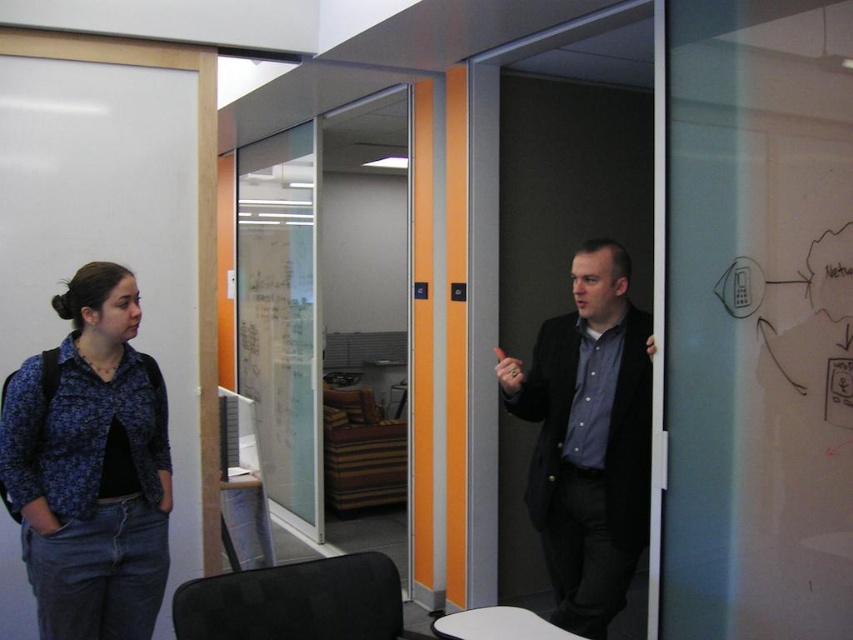
Which is below, transparent glass door at center or blue floral shirt at left?

blue floral shirt at left

Is the position of transparent glass door at center more distant than that of blue floral shirt at left?

That is True.

The height and width of the screenshot is (640, 853). I want to click on transparent glass door at center, so click(x=328, y=308).

Can you confirm if blue floral shirt at left is positioned to the right of matte black suit at center?

No, blue floral shirt at left is not to the right of matte black suit at center.

From the picture: Can you confirm if blue floral shirt at left is smaller than matte black suit at center?

Indeed, blue floral shirt at left has a smaller size compared to matte black suit at center.

This screenshot has height=640, width=853. I want to click on blue floral shirt at left, so click(x=90, y=465).

Can you confirm if transparent glass door at center is smaller than matte black suit at center?

Actually, transparent glass door at center might be larger than matte black suit at center.

Identify the location of transparent glass door at center. This screenshot has height=640, width=853. (328, 308).

Which is behind, point (316, 129) or point (593, 413)?

The point (316, 129) is more distant.

Locate an element on the screen. This screenshot has width=853, height=640. transparent glass door at center is located at coordinates (328, 308).